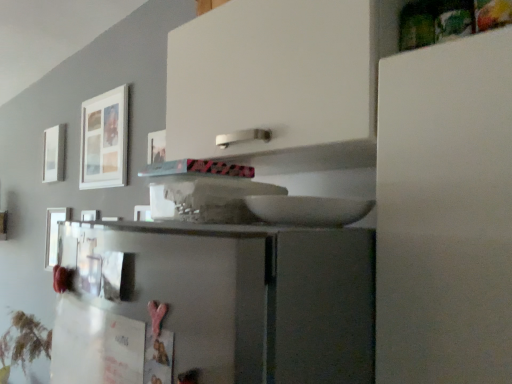
Question: Is metallic silver picture frame at left, acting as the 2th picture frame starting from the left, facing towards white matte picture frame at upper left, the first picture frame from the back?

Choices:
 (A) yes
 (B) no

Answer: (B)

Question: Can you confirm if metallic silver picture frame at left, the second picture frame positioned from the front, is thinner than white matte picture frame at upper left, arranged as the 3th picture frame when viewed from the right?

Choices:
 (A) no
 (B) yes

Answer: (B)

Question: From the image's perspective, is metallic silver picture frame at left, which is counted as the second picture frame, starting from the back, below white matte picture frame at upper left, arranged as the 3th picture frame when viewed from the right?

Choices:
 (A) yes
 (B) no

Answer: (A)

Question: Does metallic silver picture frame at left, the second picture frame in the right-to-left sequence, lie behind white matte picture frame at upper left, the first picture frame from the back?

Choices:
 (A) no
 (B) yes

Answer: (A)

Question: Is metallic silver picture frame at left, the second picture frame in the right-to-left sequence, taller than white matte picture frame at upper left, arranged as the 3th picture frame when viewed from the right?

Choices:
 (A) yes
 (B) no

Answer: (A)

Question: Does metallic silver picture frame at left, acting as the 2th picture frame starting from the left, have a larger size compared to white matte picture frame at upper left, the first picture frame from the back?

Choices:
 (A) no
 (B) yes

Answer: (A)

Question: Considering the relative sizes of white matte picture frame at upper left, which is the first picture frame from front to back, and metallic silver picture frame at left, which is counted as the second picture frame, starting from the back, in the image provided, is white matte picture frame at upper left, which is the first picture frame from front to back, smaller than metallic silver picture frame at left, which is counted as the second picture frame, starting from the back,?

Choices:
 (A) no
 (B) yes

Answer: (A)

Question: Would you say metallic silver picture frame at left, which is counted as the second picture frame, starting from the back, is part of white matte picture frame at upper left, which is counted as the 1th picture frame, starting from the right,'s contents?

Choices:
 (A) no
 (B) yes

Answer: (A)

Question: Is white matte picture frame at upper left, the third picture frame from the back, bigger than metallic silver picture frame at left, the second picture frame positioned from the front?

Choices:
 (A) no
 (B) yes

Answer: (B)

Question: From a real-world perspective, does white matte picture frame at upper left, which is counted as the 1th picture frame, starting from the right, stand above metallic silver picture frame at left, the second picture frame positioned from the front?

Choices:
 (A) no
 (B) yes

Answer: (B)

Question: Is white matte picture frame at upper left, which is the third picture frame in left-to-right order, at the right side of metallic silver picture frame at left, acting as the 2th picture frame starting from the left?

Choices:
 (A) yes
 (B) no

Answer: (A)

Question: Is white matte picture frame at upper left, which is the first picture frame from front to back, further to camera compared to metallic silver picture frame at left, which is counted as the second picture frame, starting from the back?

Choices:
 (A) no
 (B) yes

Answer: (A)

Question: From a real-world perspective, is white matte picture frame at upper left, the third picture frame from the front, physically above white matte picture frame at upper left, which is the first picture frame from front to back?

Choices:
 (A) yes
 (B) no

Answer: (B)